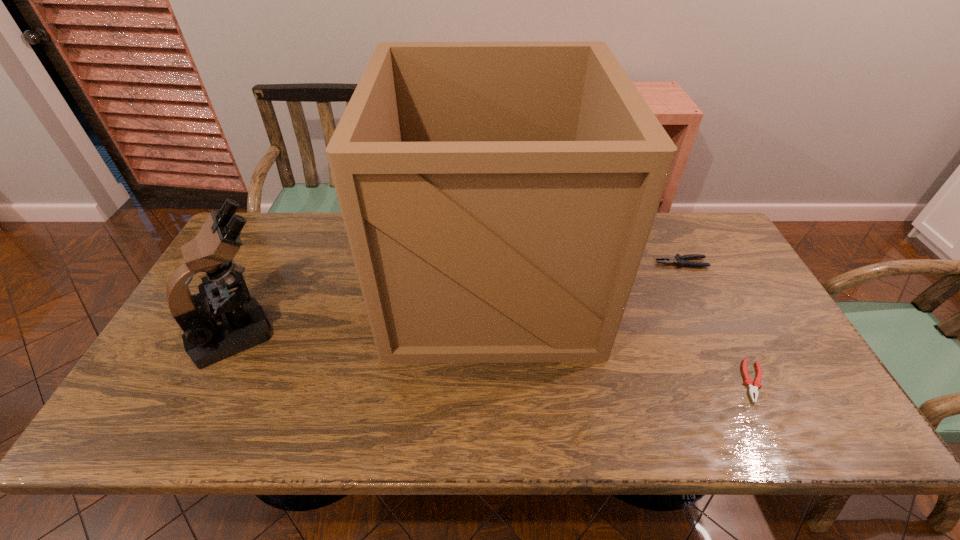
The height and width of the screenshot is (540, 960). What are the coordinates of `vacant region that satisfies the following two spatial constraints: 1. at the gripping part of the farther pliers; 2. on the front side of the tallest object` in the screenshot? It's located at (690, 282).

This screenshot has width=960, height=540. Find the location of `free spot that satisfies the following two spatial constraints: 1. at the gripping part of the third tallest object; 2. on the front side of the leftmost object`. free spot that satisfies the following two spatial constraints: 1. at the gripping part of the third tallest object; 2. on the front side of the leftmost object is located at coordinates (715, 333).

The width and height of the screenshot is (960, 540). Identify the location of free point that satisfies the following two spatial constraints: 1. at the gripping part of the taller pliers; 2. on the left side of the shorter pliers. (739, 381).